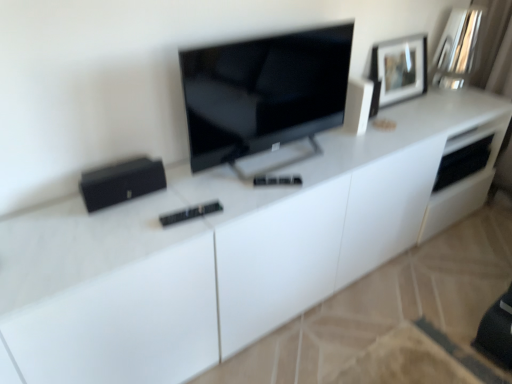
Find the location of a particular element. vacant space situated above black matte speaker at left, placed as the first appliance when sorted from front to back (from a real-world perspective) is located at coordinates [x=116, y=172].